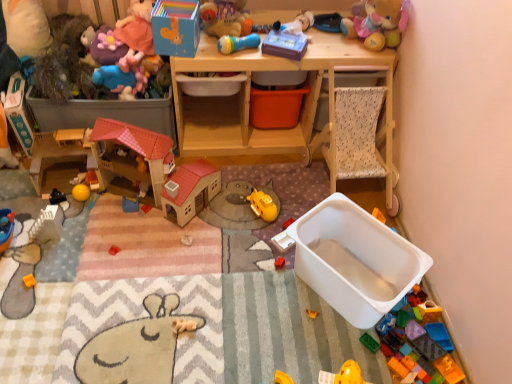
Locate an element on the screen. vacant area that is in front of wooden desk at upper center is located at coordinates (239, 213).